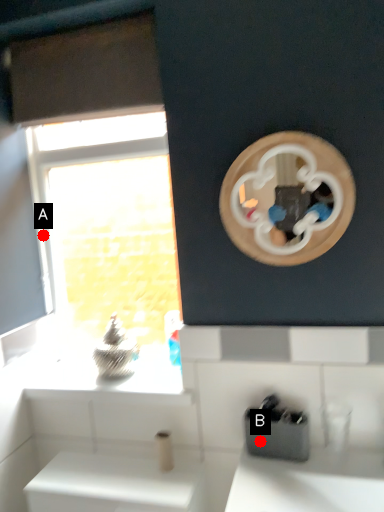
Question: Two points are circled on the image, labeled by A and B beside each circle. Which point appears farthest from the camera in this image?

Choices:
 (A) A is further
 (B) B is further

Answer: (A)